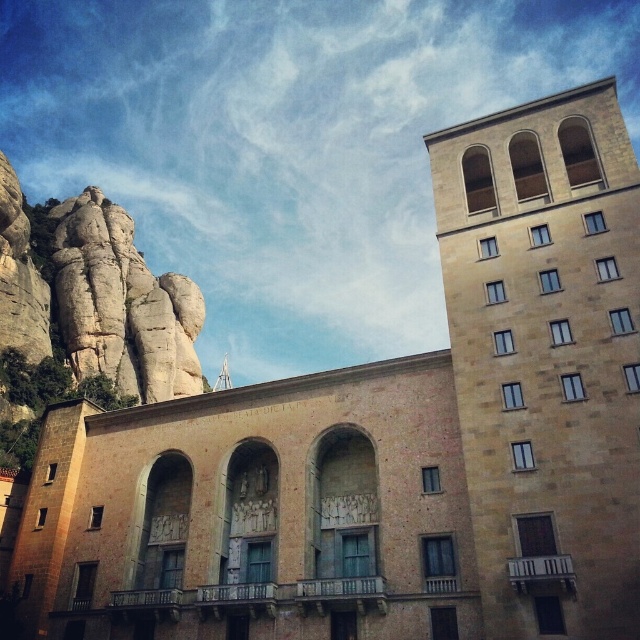
You are an architect analyzing the layout of this historic site. You see the brown stone tower at upper right and the light beige stone rock formation at upper left. Which structure is positioned further to the east?

The brown stone tower at upper right is positioned further to the east because it is to the right of the light beige stone rock formation at upper left, and in the image, east would be the right side.

You are an architect designing a new building and want to ensure it fits within the existing space. The brown stone tower at upper right and the light beige stone rock formation at upper left are both present in the scene. Which of these two structures has a smaller width?

The brown stone tower at upper right has a smaller width compared to the light beige stone rock formation at upper left.

You are standing at the center of the scene and want to take a photo of the brown stone tower at upper right. Which direction should you face to ensure the tower is in the frame?

The brown stone tower at upper right is located at point (547, 356), so you should face towards the upper right direction to capture it in your photo.